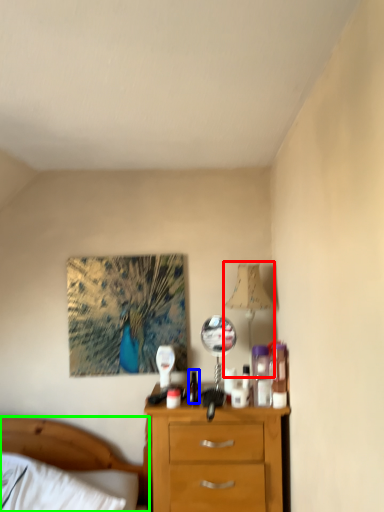
Question: Which object is the closest to the table lamp (highlighted by a red box)? Choose among these: bottle (highlighted by a blue box) or bed (highlighted by a green box).

Choices:
 (A) bottle
 (B) bed

Answer: (A)